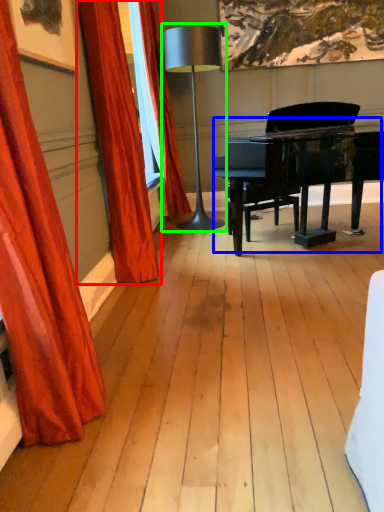
Question: Considering the real-world distances, which object is farthest from curtain (highlighted by a red box)? piano (highlighted by a blue box) or table lamp (highlighted by a green box)?

Choices:
 (A) piano
 (B) table lamp

Answer: (B)